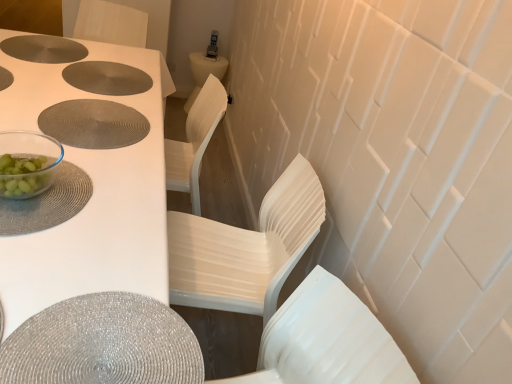
Locate an element on the screen. vacant area that is situated to the right of matte gray placemat at upper left, the 1th hole in the top-to-bottom sequence is located at coordinates (94, 70).